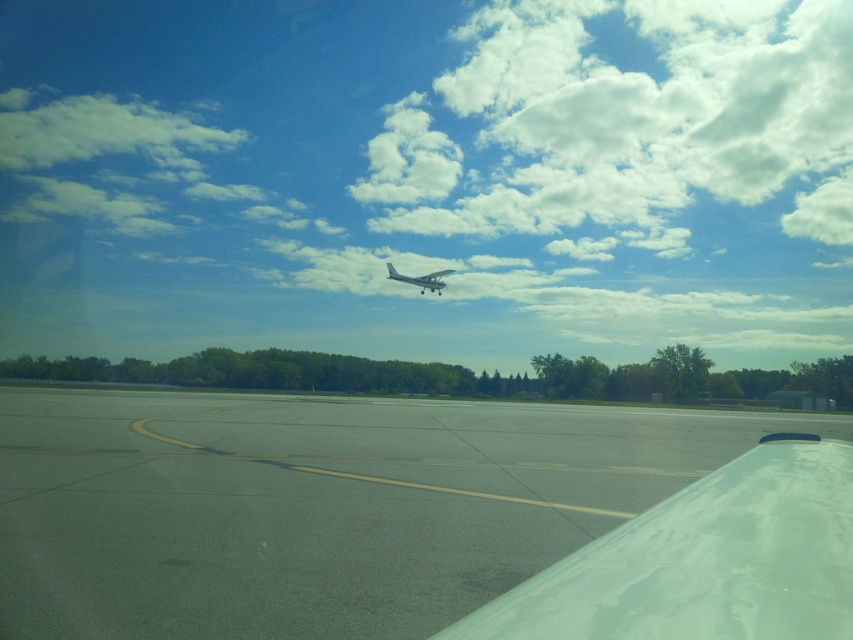
Question: Which of these objects is positioned closest to the transparent plastic airplane wing at lower right?

Choices:
 (A) white matte airplane at center
 (B) gray asphalt runway at center

Answer: (B)

Question: Is gray asphalt runway at center bigger than transparent plastic airplane wing at lower right?

Choices:
 (A) no
 (B) yes

Answer: (B)

Question: Does gray asphalt runway at center have a smaller size compared to white matte airplane at center?

Choices:
 (A) no
 (B) yes

Answer: (B)

Question: Based on their relative distances, which object is nearer to the gray asphalt runway at center?

Choices:
 (A) transparent plastic airplane wing at lower right
 (B) white matte airplane at center

Answer: (A)

Question: Does white fluffy cloud at upper center have a greater width compared to transparent plastic airplane wing at lower right?

Choices:
 (A) no
 (B) yes

Answer: (B)

Question: Which of the following is the farthest from the observer?

Choices:
 (A) (447, 413)
 (B) (598, 96)

Answer: (B)